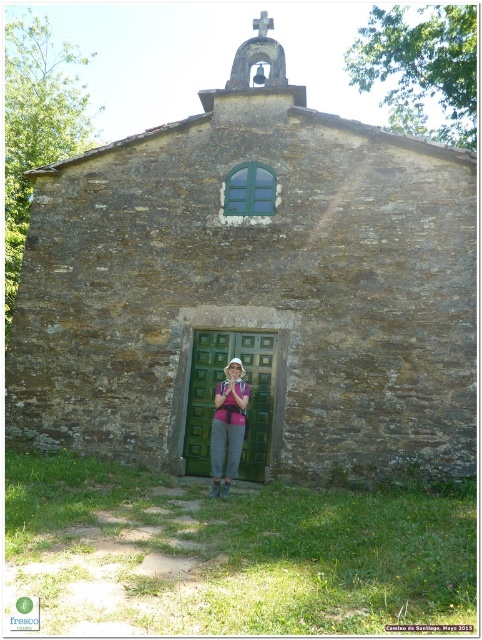
Question: Does green matte door at center appear under pink fabric at center?

Choices:
 (A) no
 (B) yes

Answer: (B)

Question: Can you confirm if green matte door at center is smaller than pink fabric at center?

Choices:
 (A) no
 (B) yes

Answer: (B)

Question: Is brown stone church at center positioned behind pink fabric at center?

Choices:
 (A) yes
 (B) no

Answer: (B)

Question: Which point is closer to the camera?

Choices:
 (A) (53, 234)
 (B) (249, 408)

Answer: (B)

Question: Which of the following is the farthest from the observer?

Choices:
 (A) (254, 404)
 (B) (278, 83)
 (C) (216, 392)

Answer: (B)

Question: Which point is closer to the camera taking this photo?

Choices:
 (A) (198, 472)
 (B) (223, 333)
 (C) (246, 392)

Answer: (C)